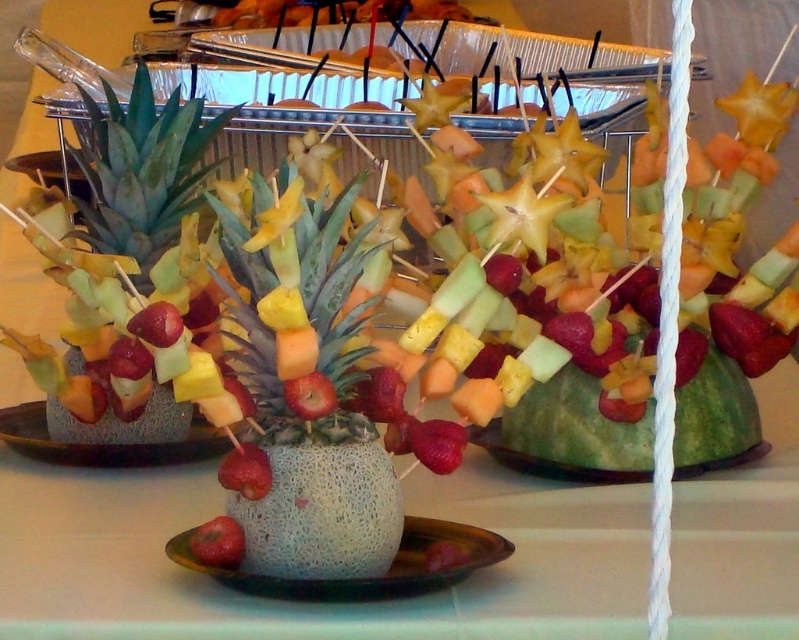
Between green leafy pineapple at center and speckled melon plate at center, which one is positioned higher?

green leafy pineapple at center is above.

Which of these two, green leafy pineapple at center or speckled melon plate at center, stands taller?

Standing taller between the two is green leafy pineapple at center.

Is point (38, 204) more distant than point (163, 452)?

Yes, point (38, 204) is behind point (163, 452).

Locate an element on the screen. Image resolution: width=799 pixels, height=640 pixels. green leafy pineapple at center is located at coordinates (129, 280).

You are a GUI agent. You are given a task and a screenshot of the screen. Output one action in this format:
    pyautogui.click(x=<x>, y=<y>)
    Task: Click on the metallic silver tray at upper center
    This screenshot has width=799, height=640.
    Given the screenshot: What is the action you would take?
    pyautogui.click(x=245, y=86)

Between metallic silver tray at upper center and green matte melon at center, which one is positioned higher?

metallic silver tray at upper center

At what (x,y) coordinates should I click in order to perform the action: click on metallic silver tray at upper center. Please return your answer as a coordinate pair (x, y). Looking at the image, I should click on (245, 86).

Is point (106, 458) farther from camera compared to point (702, 472)?

That is False.

Is speckled melon plate at center thinner than green melon at center?

Correct, speckled melon plate at center's width is less than green melon at center's.

You are a GUI agent. You are given a task and a screenshot of the screen. Output one action in this format:
    pyautogui.click(x=<x>, y=<y>)
    Task: Click on the speckled melon plate at center
    This screenshot has width=799, height=640.
    Given the screenshot: What is the action you would take?
    pyautogui.click(x=104, y=444)

At what (x,y) coordinates should I click in order to perform the action: click on speckled melon plate at center. Please return your answer as a coordinate pair (x, y). Looking at the image, I should click on (104, 444).